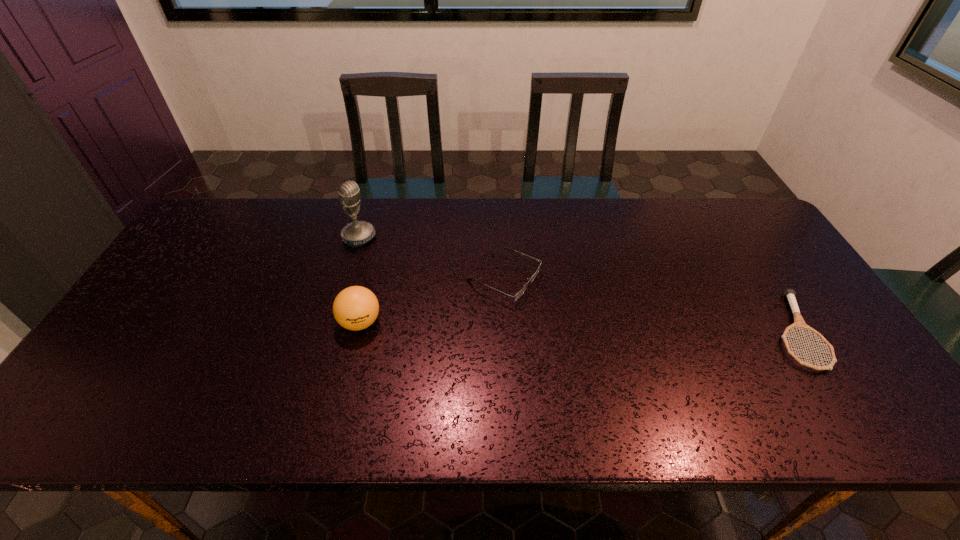
In the image, there is a desktop. Identify the location of vacant space at the near edge. point(302,363).

In order to click on vacant area at the left edge of the desktop in this screenshot , I will do `click(193, 268)`.

Find the location of a particular element. This screenshot has height=540, width=960. vacant space at the right edge of the desktop is located at coordinates (772, 299).

The height and width of the screenshot is (540, 960). In order to click on vacant region at the near left corner of the desktop in this screenshot , I will do (x=101, y=390).

Where is `vacant area that lies between the tennis racket and the second tallest object`? This screenshot has height=540, width=960. vacant area that lies between the tennis racket and the second tallest object is located at coordinates (577, 327).

Where is `free space that is in between the rightmost object and the ping-pong ball`? The image size is (960, 540). free space that is in between the rightmost object and the ping-pong ball is located at coordinates (577, 327).

I want to click on vacant area that lies between the shortest object and the third object from left to right, so click(x=649, y=305).

Where is `blank region between the microphone and the shortest object`? The height and width of the screenshot is (540, 960). blank region between the microphone and the shortest object is located at coordinates (576, 284).

This screenshot has height=540, width=960. Find the location of `free area in between the shortest object and the ping-pong ball`. free area in between the shortest object and the ping-pong ball is located at coordinates tap(577, 327).

This screenshot has width=960, height=540. Identify the location of vacant area between the second tallest object and the third object from left to right. (432, 301).